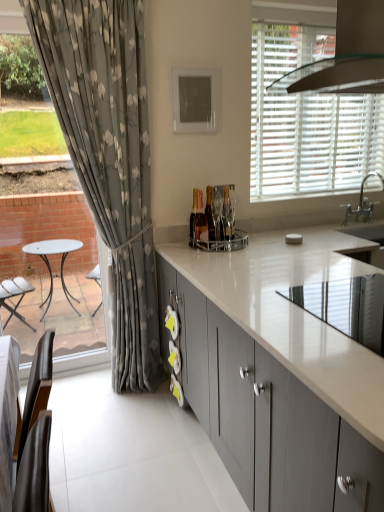
Image resolution: width=384 pixels, height=512 pixels. I want to click on free location above white matte blinds at upper right (from a real-world perspective), so coord(302,11).